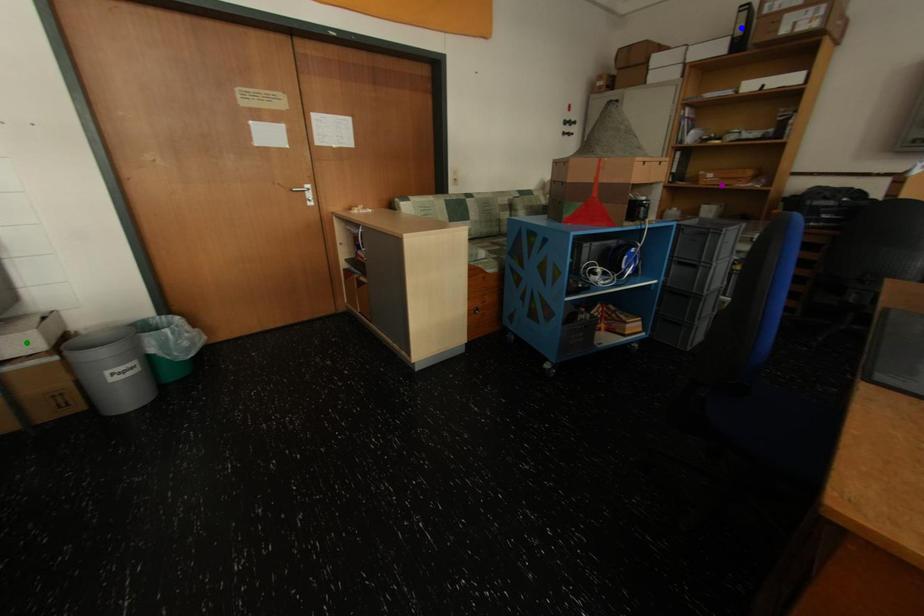
Order these from nearest to farthest:
A) green point
B) purple point
C) blue point

green point < blue point < purple point